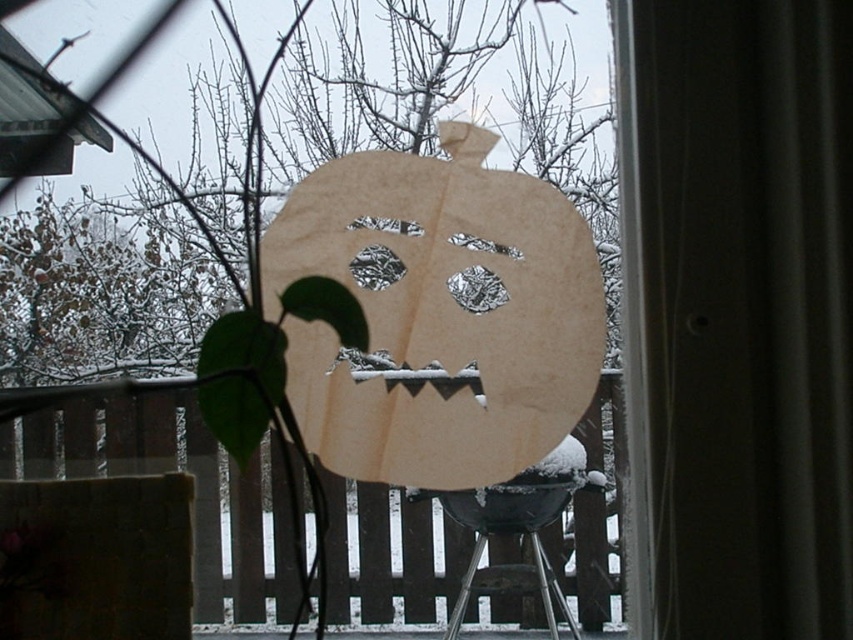
Does transparent plastic screen door at center have a greater width compared to metallic stool at lower center?

Yes.

Between transparent plastic screen door at center and metallic stool at lower center, which one appears on the left side from the viewer's perspective?

metallic stool at lower center is more to the left.

Identify the location of transparent plastic screen door at center. Image resolution: width=853 pixels, height=640 pixels. (737, 314).